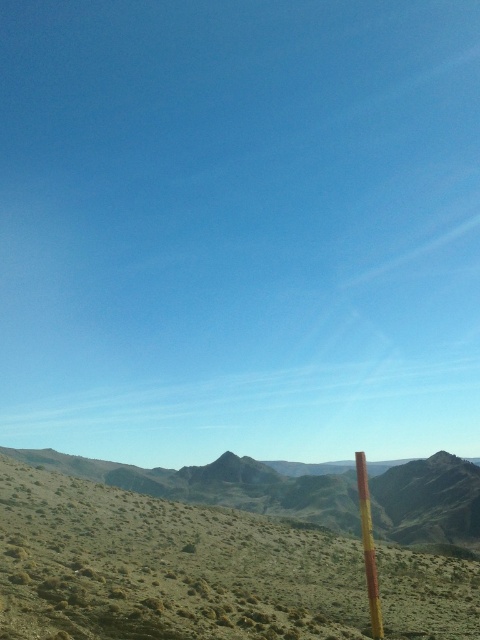
Is point (251, 556) closer to viewer compared to point (362, 532)?

No, (251, 556) is further to viewer.

Does green grassy desert at lower left have a greater width compared to yellow wood pole at right?

Yes.

What do you see at coordinates (165, 566) in the screenshot?
I see `green grassy desert at lower left` at bounding box center [165, 566].

Locate an element on the screen. green grassy desert at lower left is located at coordinates (165, 566).